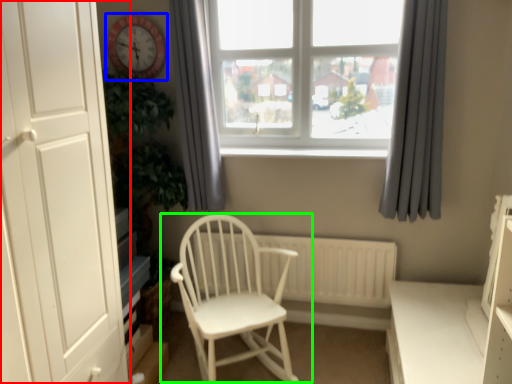
Question: Which object is positioned closest to door (highlighted by a red box)? Select from clock (highlighted by a blue box) and chair (highlighted by a green box).

Choices:
 (A) clock
 (B) chair

Answer: (B)